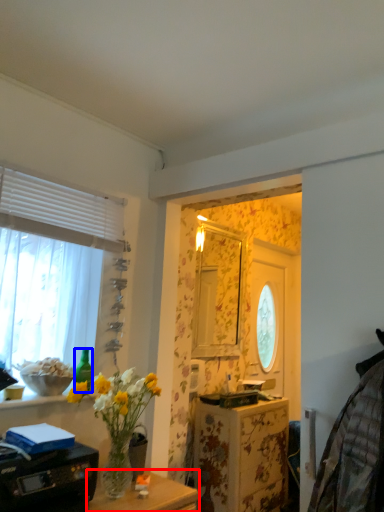
Question: Which object is further to the camera taking this photo, table (highlighted by a red box) or bottle (highlighted by a blue box)?

Choices:
 (A) table
 (B) bottle

Answer: (B)